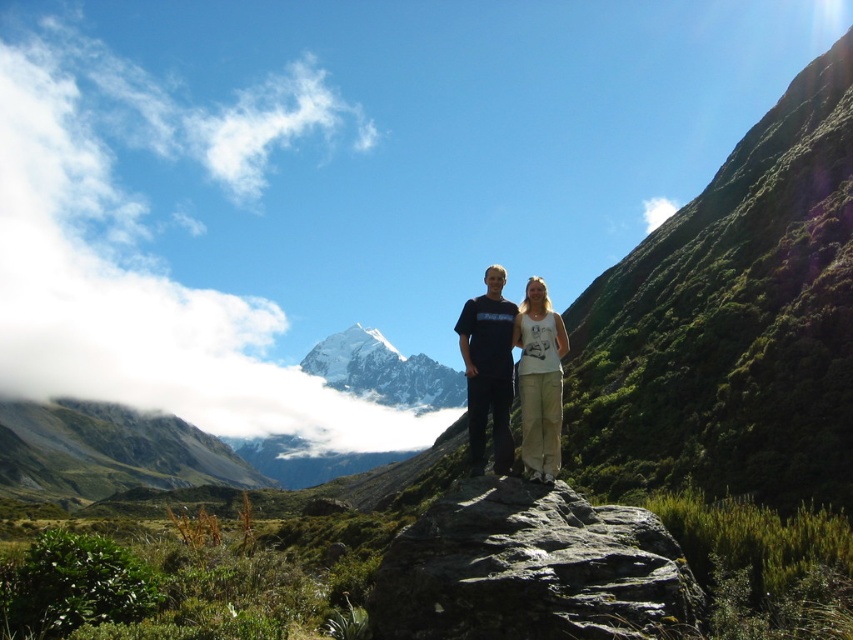
You are a photographer planning to take a photo of the rocky gray mountain at lower left and the white cotton tank top at center. Based on their positions, which object is positioned to the left side of the other?

The rocky gray mountain at lower left is positioned to the left of the white cotton tank top at center.